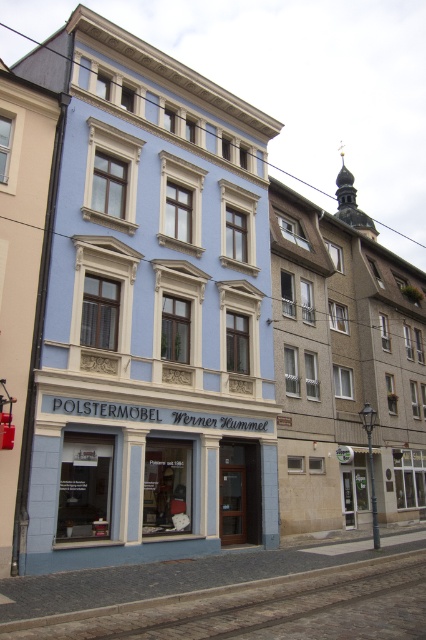
Question: Among these points, which one is farthest from the camera?

Choices:
 (A) (328, 524)
 (B) (209, 467)

Answer: (A)

Question: Is brown stone building at right above blue matte storefront at center?

Choices:
 (A) yes
 (B) no

Answer: (A)

Question: Which point is farther to the camera?

Choices:
 (A) brown stone building at right
 (B) blue matte storefront at center

Answer: (A)

Question: Does brown stone building at right have a lesser width compared to blue matte storefront at center?

Choices:
 (A) yes
 (B) no

Answer: (B)

Question: Is brown stone building at right thinner than blue matte storefront at center?

Choices:
 (A) no
 (B) yes

Answer: (A)

Question: Among these objects, which one is farthest from the camera?

Choices:
 (A) blue matte storefront at center
 (B) brown stone building at right

Answer: (B)